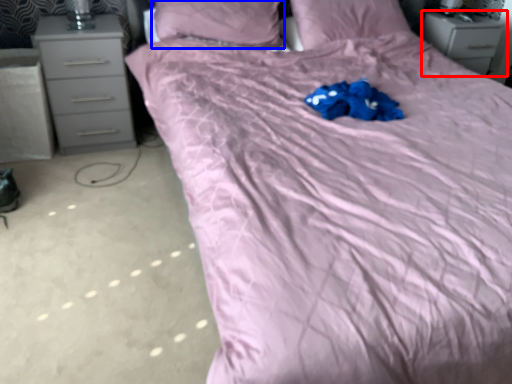
Question: Which object is further to the camera taking this photo, chest of drawers (highlighted by a red box) or pillow (highlighted by a blue box)?

Choices:
 (A) chest of drawers
 (B) pillow

Answer: (A)